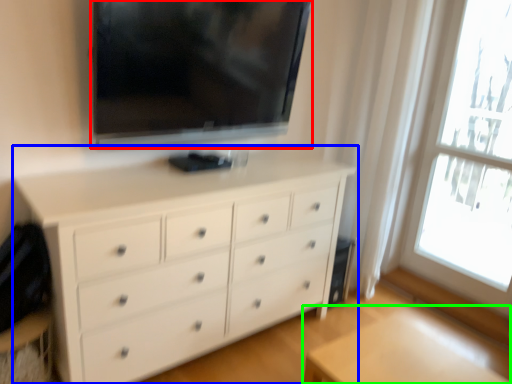
Question: Which object is positioned closest to television (highlighted by a red box)? Select from chest of drawers (highlighted by a blue box) and table (highlighted by a green box).

Choices:
 (A) chest of drawers
 (B) table

Answer: (A)